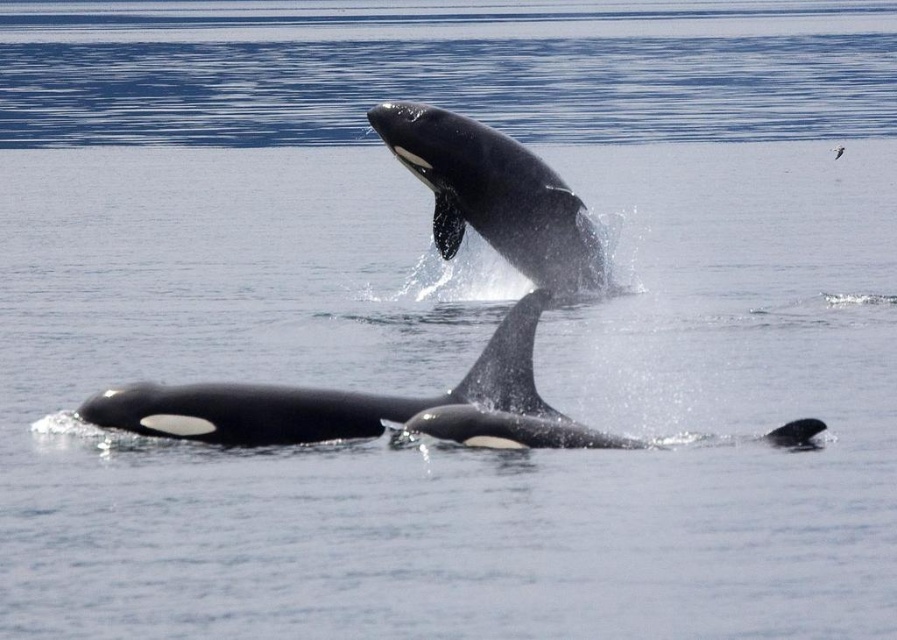
Between black smooth dolphin at center and black smooth whale at center, which one has less height?

black smooth dolphin at center is shorter.

Is black smooth dolphin at center positioned at the back of black smooth whale at center?

No, it is not.

Locate an element on the screen. The width and height of the screenshot is (897, 640). black smooth dolphin at center is located at coordinates (324, 397).

Does black smooth dolphin at center have a lesser height compared to black smooth dolphin at lower right?

No.

Does point (356, 406) come farther from viewer compared to point (806, 445)?

No, (356, 406) is closer to viewer.

Identify the location of black smooth dolphin at center. This screenshot has height=640, width=897. (324, 397).

Is black smooth whale at center shorter than black smooth dolphin at lower right?

No, black smooth whale at center is not shorter than black smooth dolphin at lower right.

Between point (471, 156) and point (816, 433), which one is positioned in front?

Point (816, 433) is more forward.

Who is more distant from viewer, [434,225] or [799,422]?

The point [434,225] is behind.

At what (x,y) coordinates should I click in order to perform the action: click on black smooth whale at center. Please return your answer as a coordinate pair (x, y). Looking at the image, I should click on (494, 195).